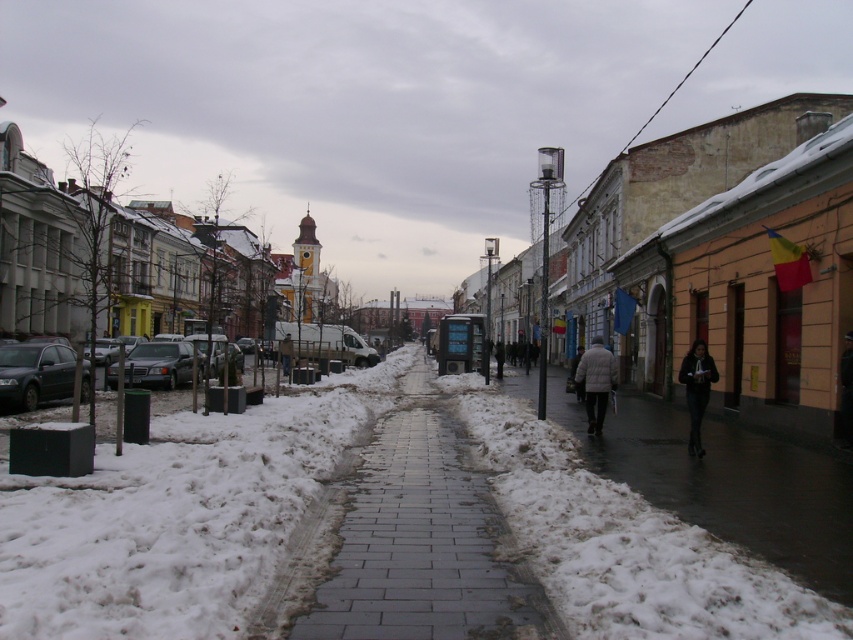
You are standing at the center of the snowy pathway in the European town scene. You notice a point marked at coordinates (33, 372). Which object in the scene does this point belong to?

The point at coordinates (33, 372) is on the matte black car at left.

Consider the image. You are a delivery person trying to reach the front door of the building. You see the gray concrete sidewalk at center and the matte black car at left. Which object is closer to you as you approach the building?

The gray concrete sidewalk at center is closer to you because it is in front of the matte black car at left, meaning the sidewalk is between you and the car.